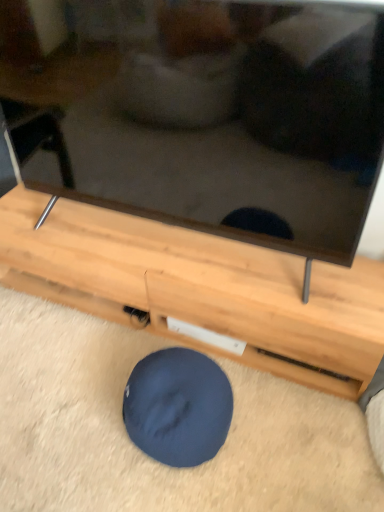
Question: Does point (329, 338) appear closer or farther from the camera than point (206, 429)?

Choices:
 (A) closer
 (B) farther

Answer: (B)

Question: Is wooden tv stand at center bigger or smaller than dark blue fabric dog bed at lower center?

Choices:
 (A) big
 (B) small

Answer: (A)

Question: Do you think wooden tv stand at center is within dark blue fabric dog bed at lower center, or outside of it?

Choices:
 (A) inside
 (B) outside

Answer: (B)

Question: Is dark blue fabric dog bed at lower center in front of or behind wooden tv stand at center in the image?

Choices:
 (A) behind
 (B) front

Answer: (B)

Question: From the image's perspective, relative to wooden tv stand at center, is dark blue fabric dog bed at lower center above or below?

Choices:
 (A) below
 (B) above

Answer: (A)

Question: Do you think dark blue fabric dog bed at lower center is within wooden tv stand at center, or outside of it?

Choices:
 (A) outside
 (B) inside

Answer: (A)

Question: From a real-world perspective, is dark blue fabric dog bed at lower center physically located above or below wooden tv stand at center?

Choices:
 (A) above
 (B) below

Answer: (B)